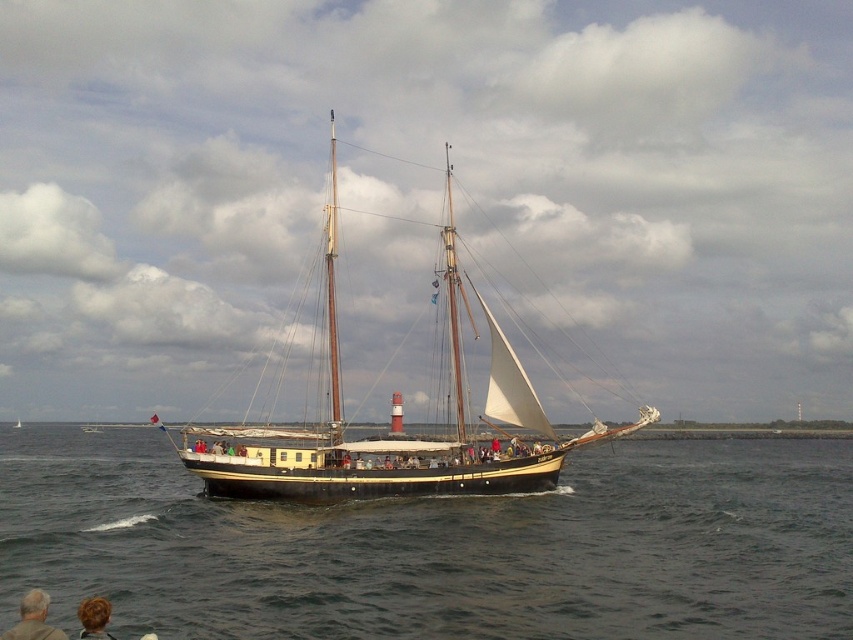
You are a passenger on the wooden sailboat at center and you want to wave to someone on the deck near the blonde hair at lower left. Which direction should you turn to face them?

The wooden sailboat at center is positioned over blonde hair at lower left, so you should turn to your left to face the blonde hair at lower left.

You are standing on the deck of the sailboat and want to estimate how far the dark blue water at center is from you. Can you determine the distance based on the information provided?

The dark blue water at center is 60.42 meters away from the camera, so the distance from your current position on the deck to the dark blue water at center is 60.42 meters.

You are standing on the deck of the sailboat and want to reach a specific point marked at coordinates point (225, 448). Given that your walking speed is 3 feet per second, how many seconds will it take you to reach that point?

The distance of point (225, 448) from camera is 338.68 feet. At a walking speed of 3 feet per second, it would take approximately 112.89 seconds to reach the point.